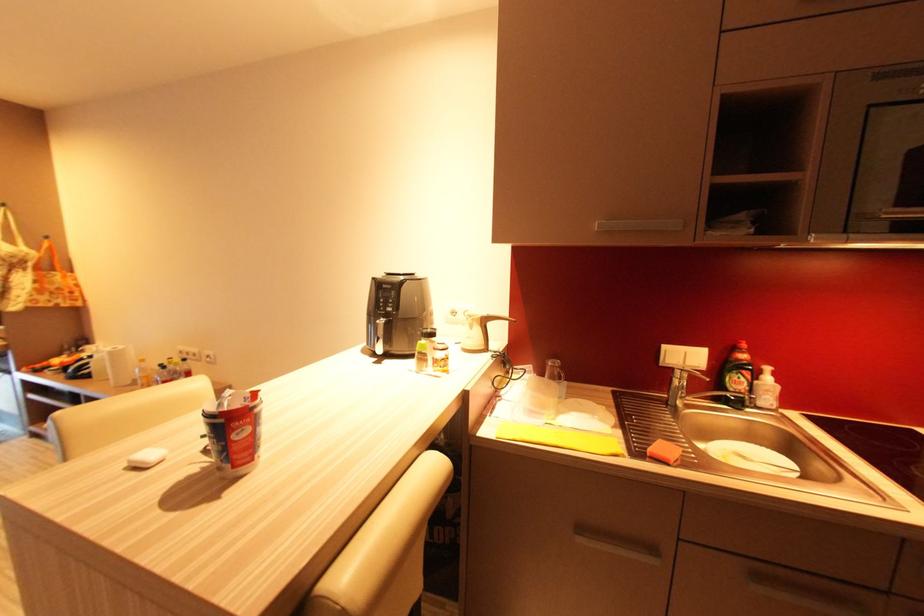
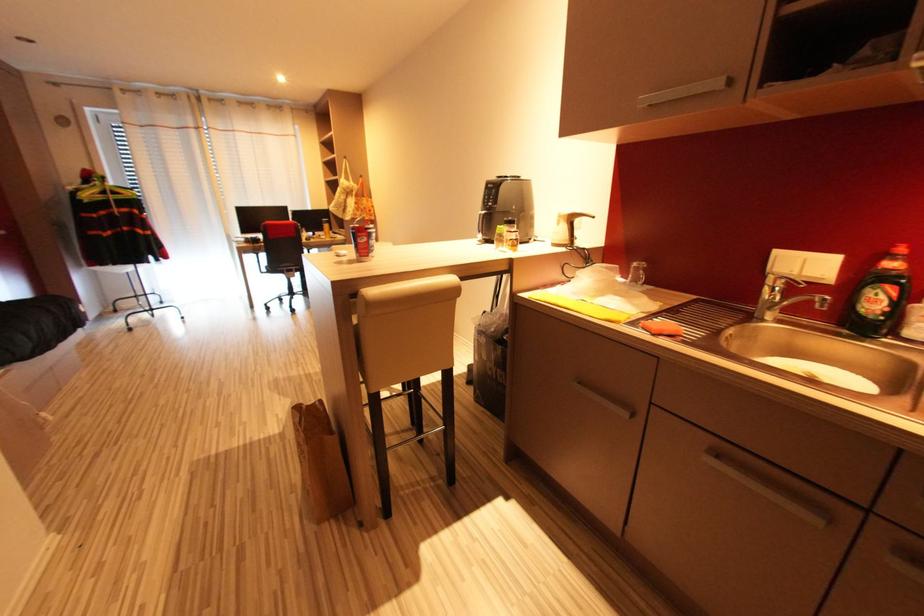
Question: How did the camera likely rotate?

Choices:
 (A) Left
 (B) Right
 (C) Up
 (D) Down

Answer: (A)